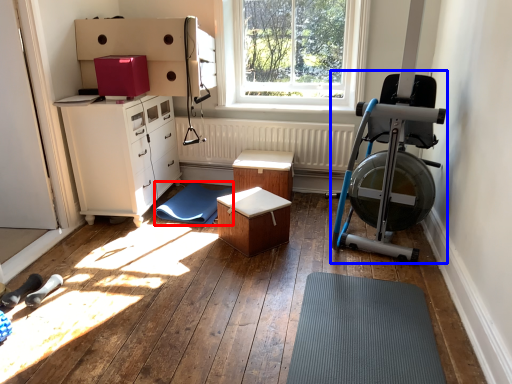
Question: Which object appears farthest to the camera in this image, doormat (highlighted by a red box) or baby carriage (highlighted by a blue box)?

Choices:
 (A) doormat
 (B) baby carriage

Answer: (A)